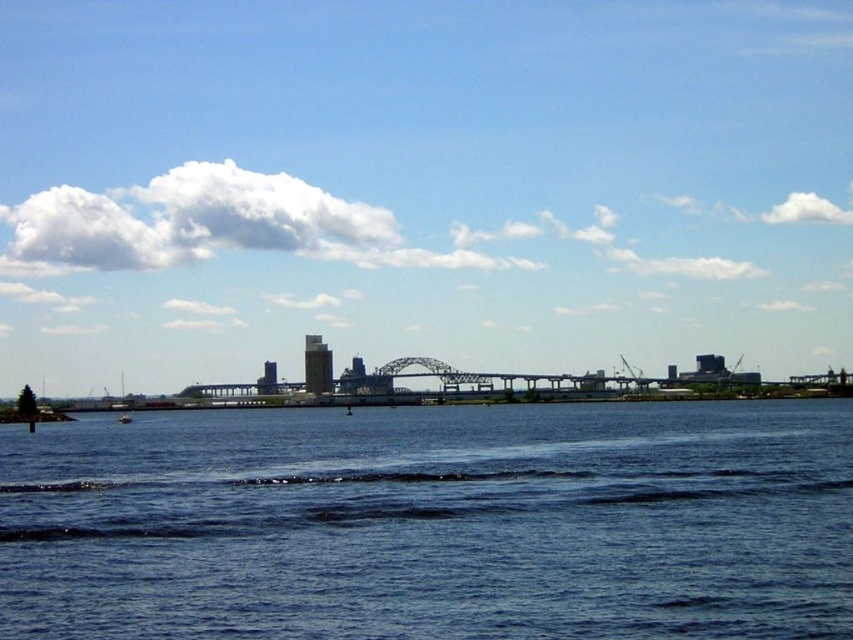
You are standing on the shore looking at the scene. There is blue water at lower center and a white plastic boat at lower left. Which object is closer to your right side?

The blue water at lower center is to the right of the white plastic boat at lower left, so from your perspective on the shore, the blue water at lower center would be closer to your right side.

You are standing at a viewpoint overlooking the water and the city. You notice two points marked on the scene. Which point is closer to you, point (515, 461) or point (125, 417)?

Point (515, 461) is closer to the viewer than point (125, 417).